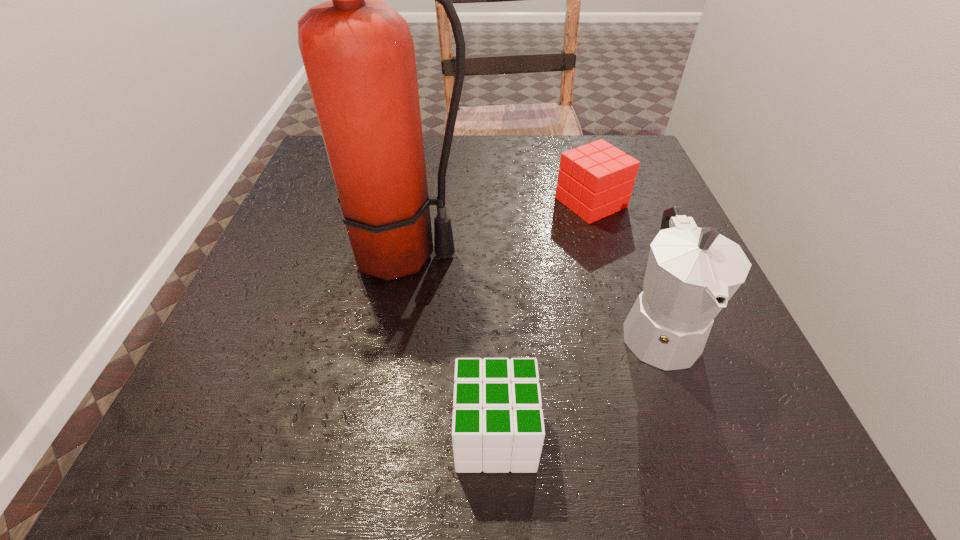
The width and height of the screenshot is (960, 540). I want to click on the tallest object, so click(x=358, y=53).

Locate an element on the screen. the second tallest object is located at coordinates (691, 274).

Where is `the farthest object`? the farthest object is located at coordinates (595, 180).

I want to click on the right cube, so click(595, 180).

This screenshot has width=960, height=540. I want to click on the nearer cube, so click(x=504, y=409).

Where is `the left cube`? The image size is (960, 540). the left cube is located at coordinates (504, 409).

I want to click on vacant space located on the nozzle of the fire extinguisher, so click(x=666, y=255).

At what (x,y) coordinates should I click in order to perform the action: click on free spot located 0.050m at the spout of the second tallest object. Please return your answer as a coordinate pair (x, y). This screenshot has width=960, height=540. Looking at the image, I should click on (690, 417).

This screenshot has height=540, width=960. I want to click on vacant area situated 0.220m on the front of the farther cube, so click(x=622, y=306).

Where is `vacant space located 0.280m on the red face of the nearest object`? This screenshot has width=960, height=540. vacant space located 0.280m on the red face of the nearest object is located at coordinates (245, 434).